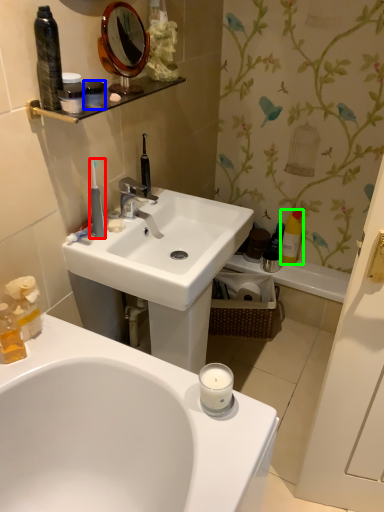
Question: Based on their relative distances, which object is farther from toothbrush (highlighted by a red box)? Choose from mouthwash (highlighted by a blue box) and mouthwash (highlighted by a green box).

Choices:
 (A) mouthwash
 (B) mouthwash

Answer: (B)